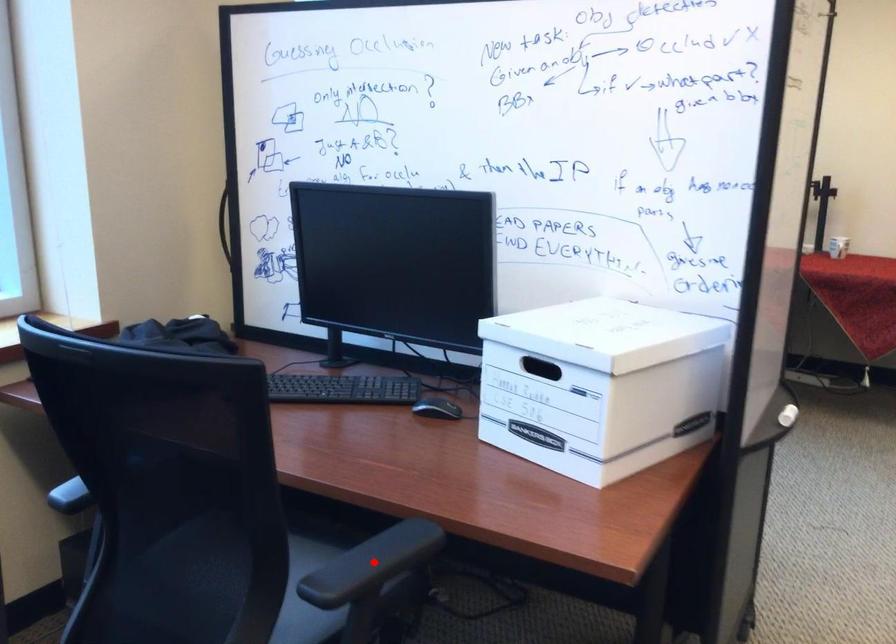
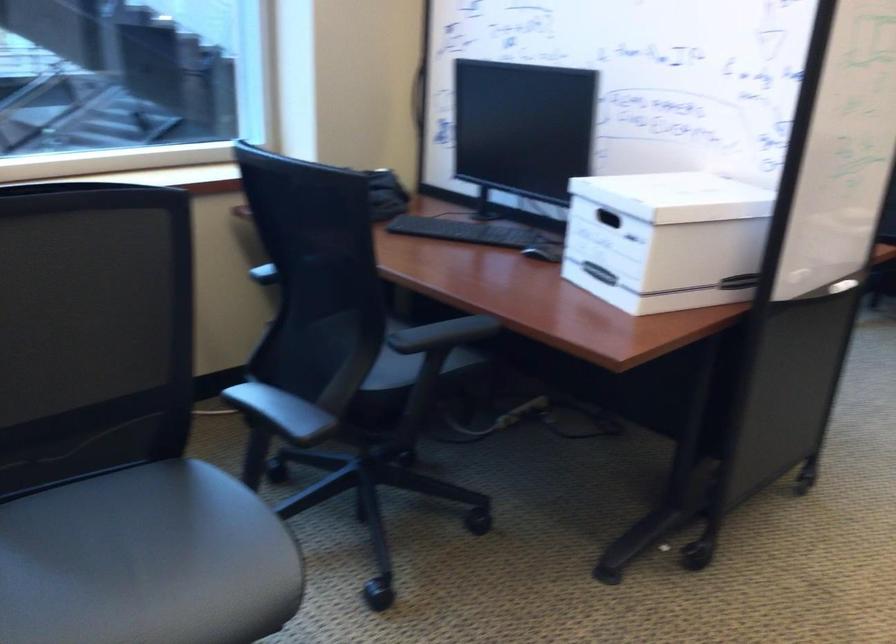
Question: I am providing you with two images of the same scene from different viewpoints. A red point is marked on the first image. Can you still see the location of the red point in image 2?

Choices:
 (A) Yes
 (B) No

Answer: (A)